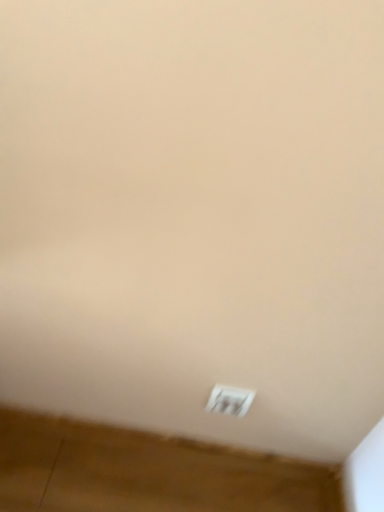
What do you see at coordinates (230, 400) in the screenshot? The image size is (384, 512). I see `white paper at lower center` at bounding box center [230, 400].

In order to click on white paper at lower center in this screenshot , I will do pyautogui.click(x=230, y=400).

Measure the distance between white paper at lower center and camera.

white paper at lower center is 85.10 centimeters away from camera.

The height and width of the screenshot is (512, 384). Identify the location of white paper at lower center. (230, 400).